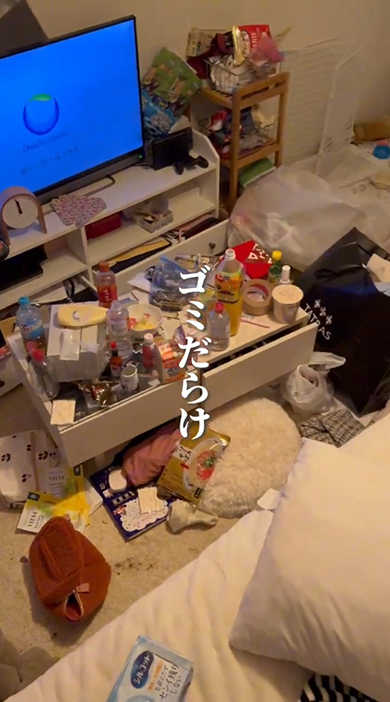
This screenshot has width=390, height=702. Identify the location of clock. tap(20, 210).